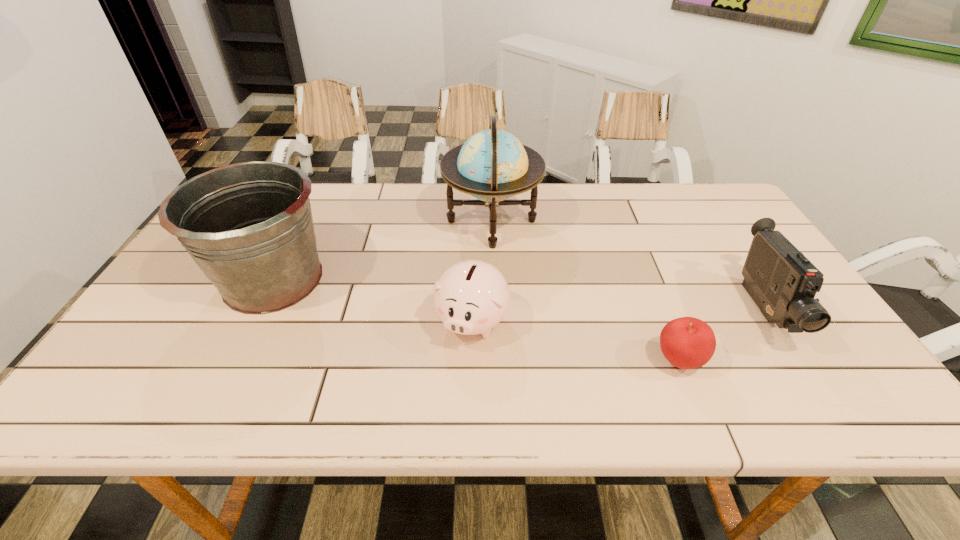
The height and width of the screenshot is (540, 960). What are the coordinates of `free space located 0.330m on the back of the leftmost object` in the screenshot? It's located at (x=322, y=182).

Locate an element on the screen. Image resolution: width=960 pixels, height=540 pixels. vacant point located 0.110m on the front-facing side of the rightmost object is located at coordinates (821, 402).

Locate an element on the screen. blank space located 0.400m on the right of the second shortest object is located at coordinates (675, 321).

At what (x,y) coordinates should I click in order to perform the action: click on vacant position located on the back of the shortest object. Please return your answer as a coordinate pair (x, y). Looking at the image, I should click on coord(663,322).

Locate an element on the screen. The image size is (960, 540). object positioned at the far edge is located at coordinates (492, 165).

Find the location of a particular element. object present at the near edge is located at coordinates (686, 342).

The width and height of the screenshot is (960, 540). Find the location of `object present at the left edge`. object present at the left edge is located at coordinates (248, 226).

Locate an element on the screen. The image size is (960, 540). object at the right edge is located at coordinates (782, 282).

I want to click on vacant space at the far edge of the desktop, so click(x=411, y=211).

The image size is (960, 540). In the image, there is a desktop. In order to click on free space at the near edge in this screenshot , I will do `click(294, 414)`.